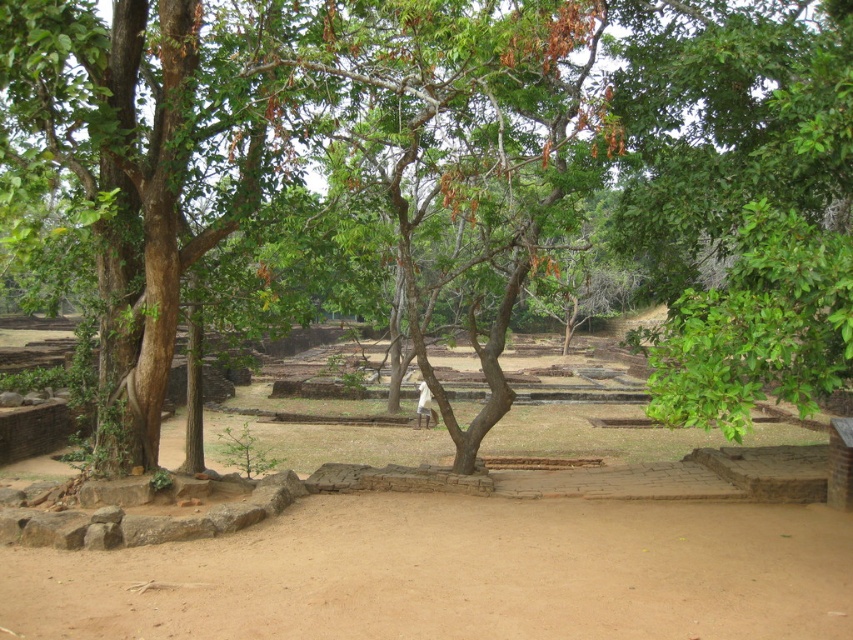
Is point (215, 563) closer to viewer compared to point (15, 620)?

No, (215, 563) is behind (15, 620).

Between point (285, 515) and point (850, 566), which one is positioned behind?

Positioned behind is point (285, 515).

Which is behind, point (795, 570) or point (601, 547)?

Positioned behind is point (601, 547).

The width and height of the screenshot is (853, 640). I want to click on brown dirt field at center, so click(467, 568).